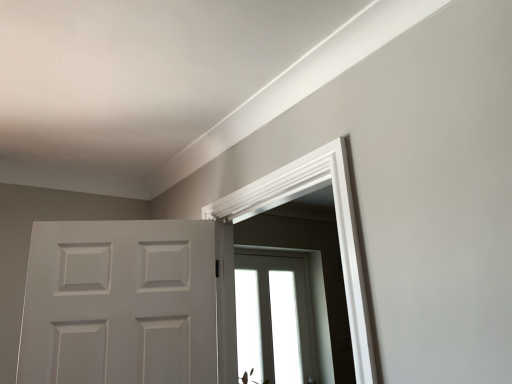
Find the location of a particular element. This screenshot has height=384, width=512. white matte door at center is located at coordinates (127, 303).

Measure the distance between transparent glass window at center and camera.

transparent glass window at center and camera are 9.68 feet apart from each other.

In order to face transparent glass window at center, should I rotate leftwards or rightwards?

A 1.995 degree turn to the right will do.

Image resolution: width=512 pixels, height=384 pixels. What are the coordinates of `white matte door at center` in the screenshot? It's located at (127, 303).

Which of these two, transparent glass window at center or white matte door at center, stands taller?

Standing taller between the two is transparent glass window at center.

Can you confirm if transparent glass window at center is wider than white matte door at center?

In fact, transparent glass window at center might be narrower than white matte door at center.

Is transparent glass window at center facing towards white matte door at center?

No, transparent glass window at center is not facing towards white matte door at center.

Considering the positions of point (236, 318) and point (178, 315), is point (236, 318) closer or farther from the camera than point (178, 315)?

Point (236, 318) is positioned farther from the camera compared to point (178, 315).

In the scene shown: Which of these two, transparent glass window at center or white smooth door frame at upper center, is bigger?

With larger size is white smooth door frame at upper center.

Looking at this image, is transparent glass window at center not inside white smooth door frame at upper center?

transparent glass window at center is positioned outside white smooth door frame at upper center.

Is point (303, 345) positioned behind point (300, 189)?

Yes, point (303, 345) is farther from viewer.

Is transparent glass window at center at the right side of white smooth door frame at upper center?

Yes.

Is white smooth door frame at upper center behind transparent glass window at center?

No, the depth of white smooth door frame at upper center is less than that of transparent glass window at center.

From a real-world perspective, who is located lower, white smooth door frame at upper center or transparent glass window at center?

transparent glass window at center.

Is white smooth door frame at upper center facing away from transparent glass window at center?

white smooth door frame at upper center is not turned away from transparent glass window at center.

Considering the positions of point (345, 150) and point (284, 278), is point (345, 150) closer or farther from the camera than point (284, 278)?

Point (345, 150) is positioned closer to the camera compared to point (284, 278).

The image size is (512, 384). In order to click on door below the white smooth door frame at upper center (from a real-world perspective) in this screenshot , I will do `click(127, 303)`.

Can you confirm if white smooth door frame at upper center is smaller than white matte door at center?

Actually, white smooth door frame at upper center might be larger than white matte door at center.

Does point (343, 158) come behind point (67, 278)?

No, it is not.

From a real-world perspective, which is physically above, white smooth door frame at upper center or white matte door at center?

white smooth door frame at upper center is physically above.

Between point (180, 264) and point (301, 315), which one is positioned in front?

The point (180, 264) is more forward.

Is transparent glass window at center at the back of white matte door at center?

That's right, white matte door at center is facing away from transparent glass window at center.

Which object is positioned more to the right, white matte door at center or transparent glass window at center?

transparent glass window at center is more to the right.

Would you say white matte door at center is inside or outside white smooth door frame at upper center?

white matte door at center is outside white smooth door frame at upper center.

From the image's perspective, which is above, white matte door at center or white smooth door frame at upper center?

white smooth door frame at upper center, from the image's perspective.

Is white matte door at center taller or shorter than white smooth door frame at upper center?

In the image, white matte door at center appears to be shorter than white smooth door frame at upper center.

Is the depth of white matte door at center less than that of white smooth door frame at upper center?

That is False.

The image size is (512, 384). Identify the location of door above the transparent glass window at center (from a real-world perspective). (127, 303).

Image resolution: width=512 pixels, height=384 pixels. Identify the location of window frame on the left of transparent glass window at center. (337, 230).

Consider the image. Looking at the image, which one is located closer to white matte door at center, white smooth door frame at upper center or transparent glass window at center?

white smooth door frame at upper center lies closer to white matte door at center than the other object.

When comparing their distances from white smooth door frame at upper center, does white matte door at center or transparent glass window at center seem closer?

Among the two, white matte door at center is located nearer to white smooth door frame at upper center.

When comparing their distances from transparent glass window at center, does white smooth door frame at upper center or white matte door at center seem further?

Among the two, white smooth door frame at upper center is located further to transparent glass window at center.

From the image, which object appears to be nearer to white smooth door frame at upper center, transparent glass window at center or white matte door at center?

white matte door at center is positioned closer to the anchor white smooth door frame at upper center.

Based on their spatial positions, is white matte door at center or white smooth door frame at upper center further from transparent glass window at center?

white smooth door frame at upper center is positioned further to the anchor transparent glass window at center.

Considering their positions, is transparent glass window at center positioned further to white matte door at center than white smooth door frame at upper center?

The object further to white matte door at center is transparent glass window at center.

What are the coordinates of `door between white smooth door frame at upper center and transparent glass window at center along the z-axis` in the screenshot? It's located at pyautogui.click(x=127, y=303).